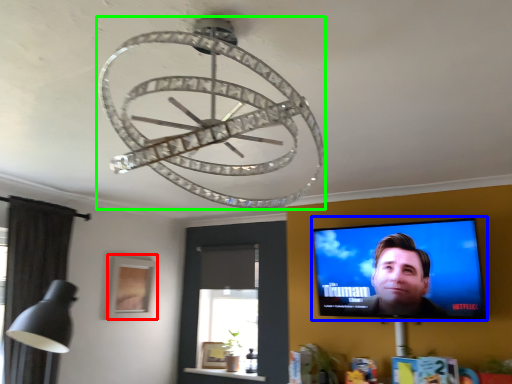
Question: Which object is the farthest from picture frame (highlighted by a red box)? Choose among these: computer screen (highlighted by a blue box) or lamp (highlighted by a green box).

Choices:
 (A) computer screen
 (B) lamp

Answer: (B)